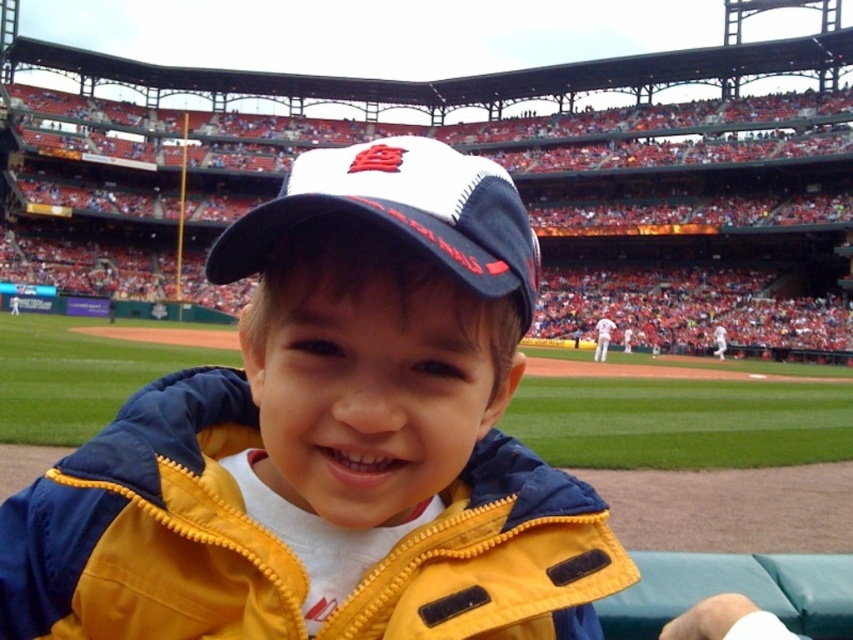
Question: Observing the image, what is the correct spatial positioning of yellow quilted jacket at center in reference to white mesh cap at center?

Choices:
 (A) left
 (B) right

Answer: (B)

Question: In this image, where is yellow quilted jacket at center located relative to white mesh cap at center?

Choices:
 (A) above
 (B) below

Answer: (B)

Question: Considering the relative positions of yellow quilted jacket at center and white mesh cap at center in the image provided, where is yellow quilted jacket at center located with respect to white mesh cap at center?

Choices:
 (A) right
 (B) left

Answer: (A)

Question: Which of the following is the farthest from the observer?

Choices:
 (A) white mesh cap at center
 (B) yellow quilted jacket at center

Answer: (A)